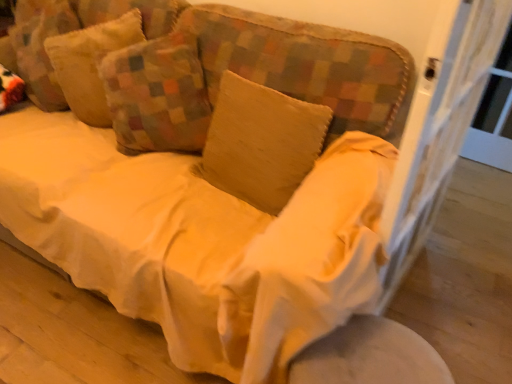
Question: Does textured beige pillow at upper left, the 3th pillow from the right, have a lesser height compared to beige cotton pillow at center, arranged as the 1th pillow when viewed from the right?

Choices:
 (A) yes
 (B) no

Answer: (B)

Question: Can you confirm if textured beige pillow at upper left, the 1th pillow when ordered from left to right, is taller than beige cotton pillow at center, marked as the third pillow in a left-to-right arrangement?

Choices:
 (A) no
 (B) yes

Answer: (B)

Question: Is textured beige pillow at upper left, the 3th pillow from the right, behind beige cotton pillow at center, marked as the third pillow in a left-to-right arrangement?

Choices:
 (A) no
 (B) yes

Answer: (B)

Question: From a real-world perspective, is textured beige pillow at upper left, the 1th pillow when ordered from left to right, beneath beige cotton pillow at center, arranged as the 1th pillow when viewed from the right?

Choices:
 (A) no
 (B) yes

Answer: (A)

Question: Is textured beige pillow at upper left, the 3th pillow from the right, positioned with its back to beige cotton pillow at center, marked as the third pillow in a left-to-right arrangement?

Choices:
 (A) yes
 (B) no

Answer: (B)

Question: From the image's perspective, relative to textured beige pillow at upper left, which is counted as the second pillow, starting from the left, is textured beige pillow at upper left, the 3th pillow from the right, above or below?

Choices:
 (A) above
 (B) below

Answer: (A)

Question: Relative to textured beige pillow at upper left, the second pillow positioned from the right, is textured beige pillow at upper left, the 1th pillow when ordered from left to right, in front or behind?

Choices:
 (A) behind
 (B) front

Answer: (A)

Question: In terms of height, does textured beige pillow at upper left, the 3th pillow from the right, look taller or shorter compared to textured beige pillow at upper left, which is counted as the second pillow, starting from the left?

Choices:
 (A) short
 (B) tall

Answer: (B)

Question: Looking at the image, does textured beige pillow at upper left, the 1th pillow when ordered from left to right, seem bigger or smaller compared to textured beige pillow at upper left, which is counted as the second pillow, starting from the left?

Choices:
 (A) big
 (B) small

Answer: (B)

Question: Looking at their shapes, would you say white fabric round table at lower right is wider or thinner than textured beige pillow at upper left, the second pillow positioned from the right?

Choices:
 (A) wide
 (B) thin

Answer: (A)

Question: Is white fabric round table at lower right spatially inside textured beige pillow at upper left, the second pillow positioned from the right, or outside of it?

Choices:
 (A) inside
 (B) outside

Answer: (B)

Question: From a real-world perspective, relative to textured beige pillow at upper left, the second pillow positioned from the right, is white fabric round table at lower right vertically above or below?

Choices:
 (A) below
 (B) above

Answer: (A)

Question: Looking at the image, does white fabric round table at lower right seem bigger or smaller compared to textured beige pillow at upper left, which is counted as the second pillow, starting from the left?

Choices:
 (A) small
 (B) big

Answer: (A)

Question: Considering the positions of beige cotton pillow at center, arranged as the 1th pillow when viewed from the right, and textured beige pillow at upper left, the 1th pillow when ordered from left to right, in the image, is beige cotton pillow at center, arranged as the 1th pillow when viewed from the right, bigger or smaller than textured beige pillow at upper left, the 1th pillow when ordered from left to right,?

Choices:
 (A) big
 (B) small

Answer: (B)

Question: Based on their positions, is beige cotton pillow at center, arranged as the 1th pillow when viewed from the right, located to the left or right of textured beige pillow at upper left, the 1th pillow when ordered from left to right?

Choices:
 (A) left
 (B) right

Answer: (B)